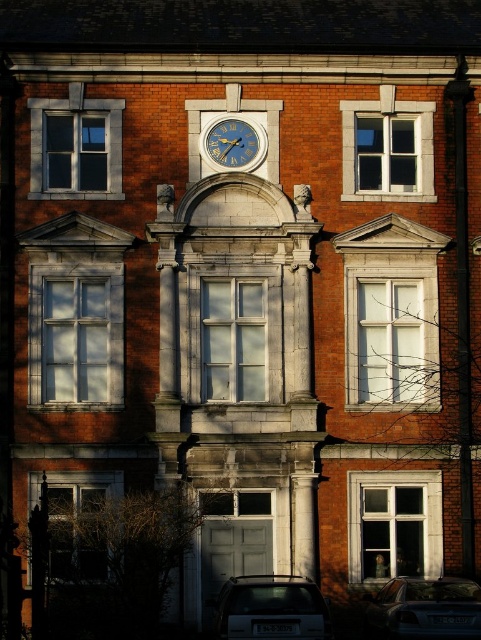
Question: Is white wooden window at center above matte gray window at left?

Choices:
 (A) no
 (B) yes

Answer: (A)

Question: Among these points, which one is nearest to the camera?

Choices:
 (A) (226, 332)
 (B) (119, 477)
 (C) (210, 156)
 (D) (427, 115)

Answer: (B)

Question: Which point is farther to the camera?

Choices:
 (A) (262, 296)
 (B) (475, 625)
 (C) (32, 182)

Answer: (C)

Question: Among these points, which one is nearest to the camera?

Choices:
 (A) (393, 477)
 (B) (42, 173)

Answer: (A)

Question: Is matte gray window at left positioned in front of white glass window at center?

Choices:
 (A) no
 (B) yes

Answer: (B)

Question: Does matte glass window at upper left appear on the left side of matte glass window at lower left?

Choices:
 (A) no
 (B) yes

Answer: (B)